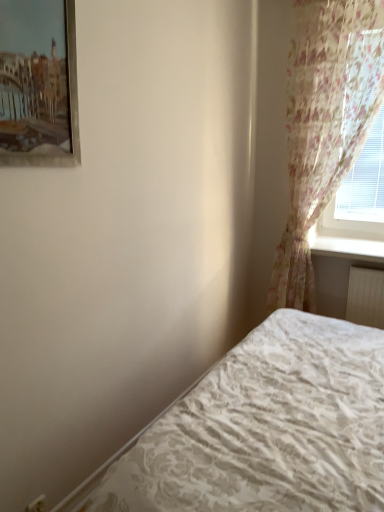
Question: Are metallic silver picture frame at upper left and white textured bed at lower right located far from each other?

Choices:
 (A) no
 (B) yes

Answer: (B)

Question: From a real-world perspective, is metallic silver picture frame at upper left on white textured bed at lower right?

Choices:
 (A) no
 (B) yes

Answer: (B)

Question: Is metallic silver picture frame at upper left aimed at white textured bed at lower right?

Choices:
 (A) yes
 (B) no

Answer: (B)

Question: Is metallic silver picture frame at upper left thinner than white textured bed at lower right?

Choices:
 (A) yes
 (B) no

Answer: (A)

Question: Considering the relative sizes of metallic silver picture frame at upper left and white textured bed at lower right in the image provided, is metallic silver picture frame at upper left smaller than white textured bed at lower right?

Choices:
 (A) no
 (B) yes

Answer: (B)

Question: In the image, is white glossy window sill at upper right positioned in front of or behind metallic silver picture frame at upper left?

Choices:
 (A) behind
 (B) front

Answer: (A)

Question: Is white glossy window sill at upper right to the left or to the right of metallic silver picture frame at upper left in the image?

Choices:
 (A) left
 (B) right

Answer: (B)

Question: Looking at the image, does white glossy window sill at upper right seem bigger or smaller compared to metallic silver picture frame at upper left?

Choices:
 (A) big
 (B) small

Answer: (A)

Question: Looking at their shapes, would you say white glossy window sill at upper right is wider or thinner than metallic silver picture frame at upper left?

Choices:
 (A) wide
 (B) thin

Answer: (A)

Question: In terms of height, does floral sheer curtain at right look taller or shorter compared to white glossy window sill at upper right?

Choices:
 (A) short
 (B) tall

Answer: (B)

Question: Looking at their shapes, would you say floral sheer curtain at right is wider or thinner than white glossy window sill at upper right?

Choices:
 (A) thin
 (B) wide

Answer: (A)

Question: Which is correct: floral sheer curtain at right is inside white glossy window sill at upper right, or outside of it?

Choices:
 (A) inside
 (B) outside

Answer: (B)

Question: From a real-world perspective, is floral sheer curtain at right physically located above or below white glossy window sill at upper right?

Choices:
 (A) below
 (B) above

Answer: (B)

Question: Is metallic silver picture frame at upper left inside or outside of white textured bed at lower right?

Choices:
 (A) outside
 (B) inside

Answer: (A)

Question: Looking at their shapes, would you say metallic silver picture frame at upper left is wider or thinner than white textured bed at lower right?

Choices:
 (A) wide
 (B) thin

Answer: (B)